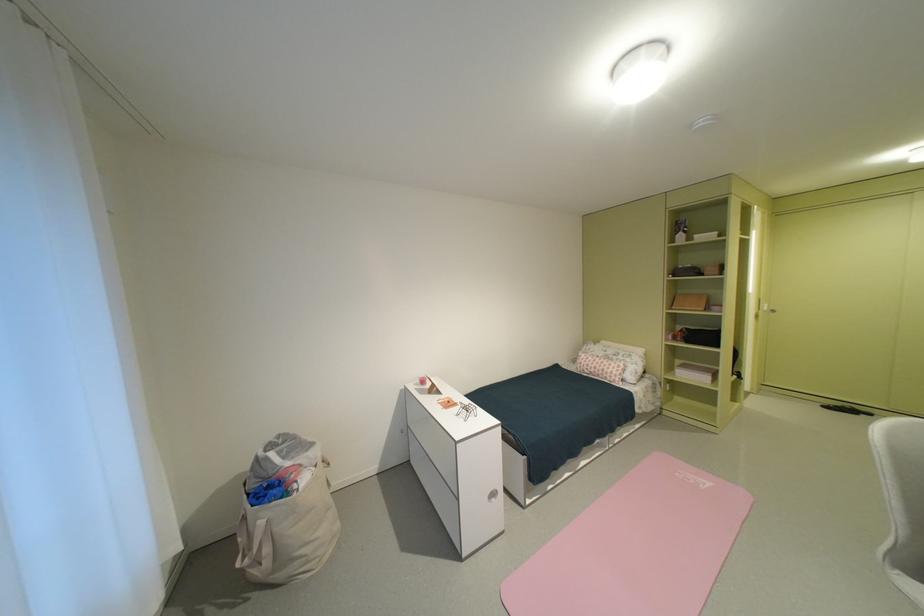
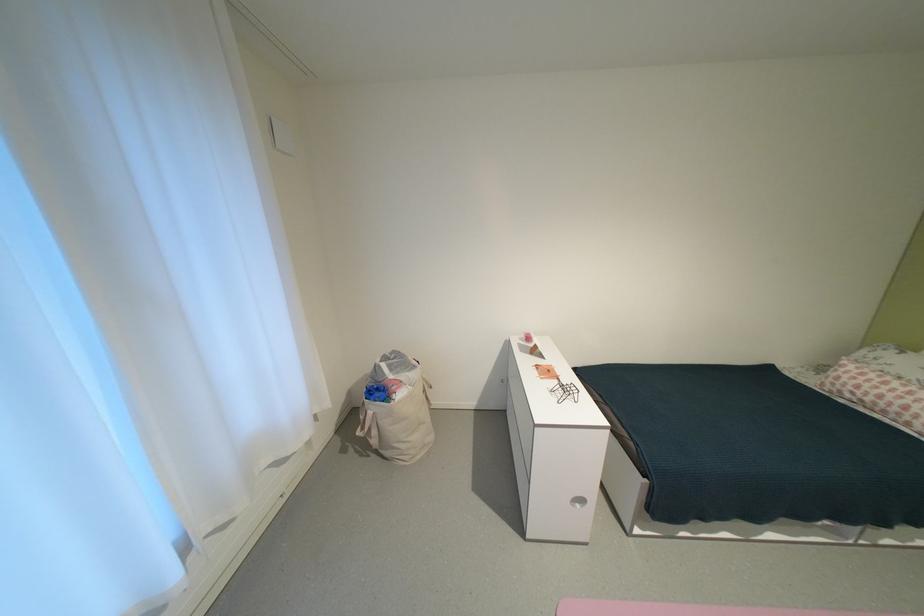
Locate, in the second image, the point that corresponds to pixel 598 369 in the first image.

(867, 392)